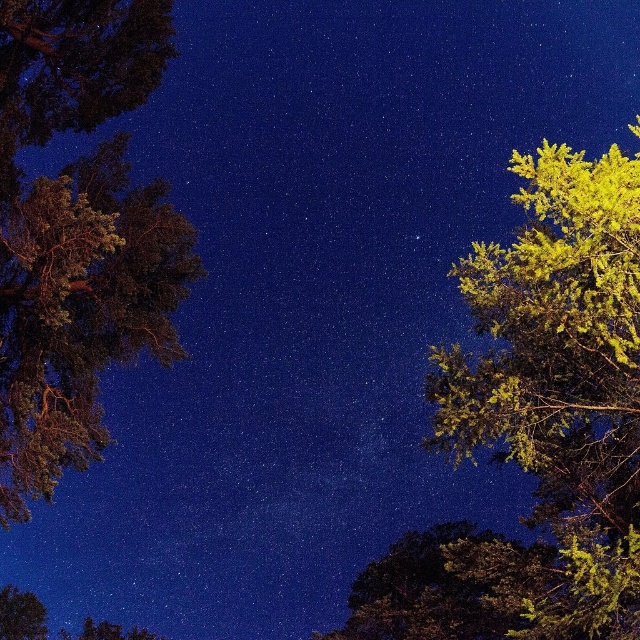
Is green leafy tree at right positioned in front of dark green textured tree at left?

Yes, green leafy tree at right is in front of dark green textured tree at left.

Who is more forward, (593, 202) or (86, 80)?

Positioned in front is point (593, 202).

Find the location of a particular element. The height and width of the screenshot is (640, 640). green leafy tree at right is located at coordinates (557, 390).